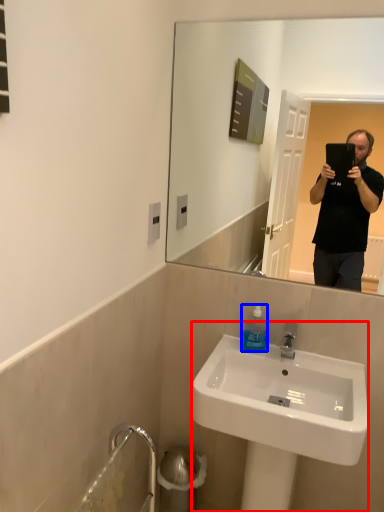
Question: Which point is closer to the camera, sink (highlighted by a red box) or bottle (highlighted by a blue box)?

Choices:
 (A) sink
 (B) bottle

Answer: (A)